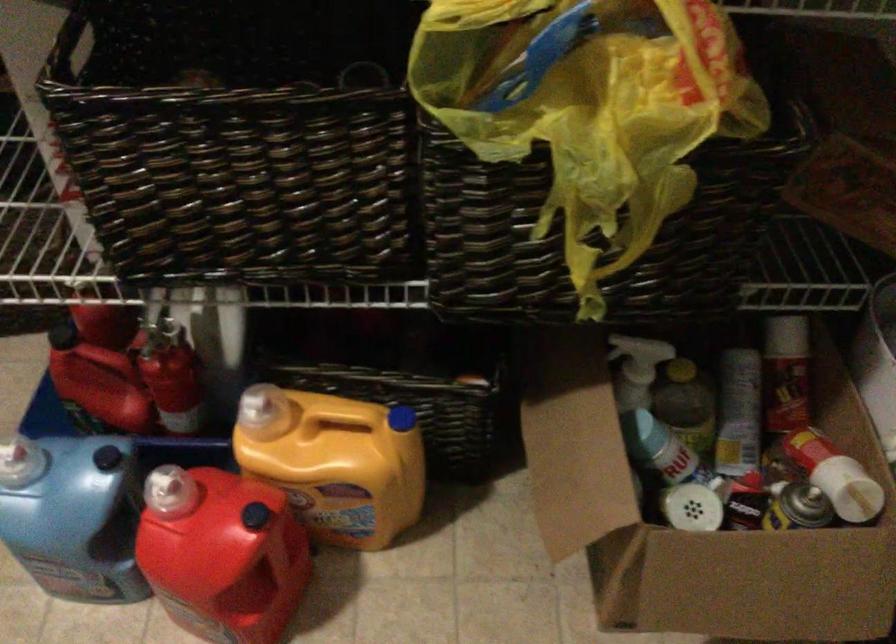
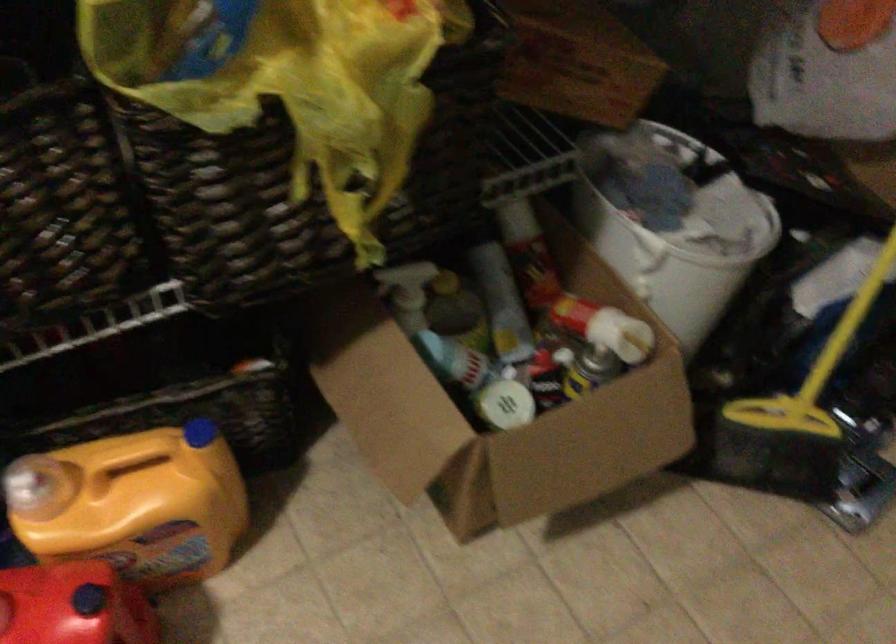
The point at (645, 400) is marked in the first image. Where is the corresponding point in the second image?

(426, 322)